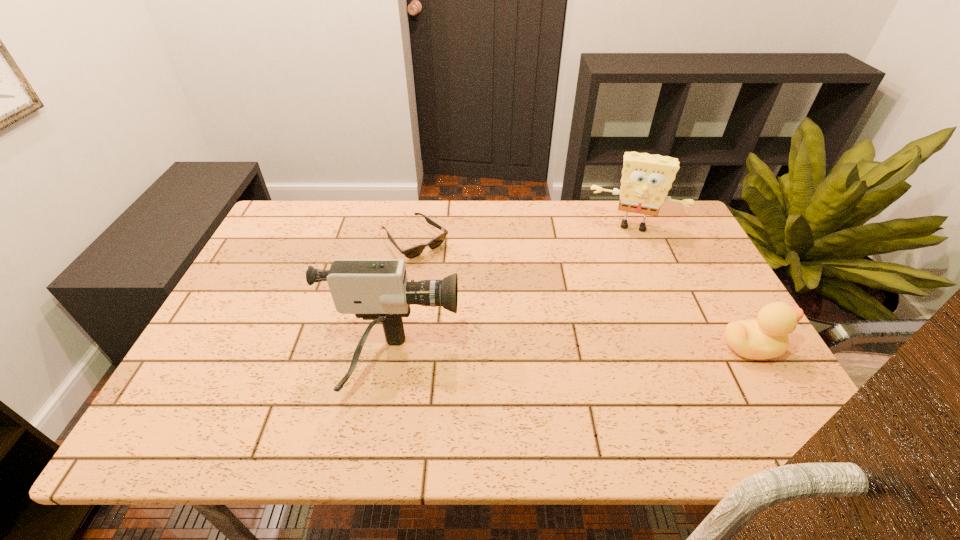
This screenshot has width=960, height=540. I want to click on free space on the desktop that is between the camcorder and the duck and is positioned on the face of the sponge, so click(x=623, y=353).

Find the location of a particular element. The height and width of the screenshot is (540, 960). free space on the desktop that is between the camcorder and the third tallest object and is positioned on the front-facing side of the sunglasses is located at coordinates (537, 357).